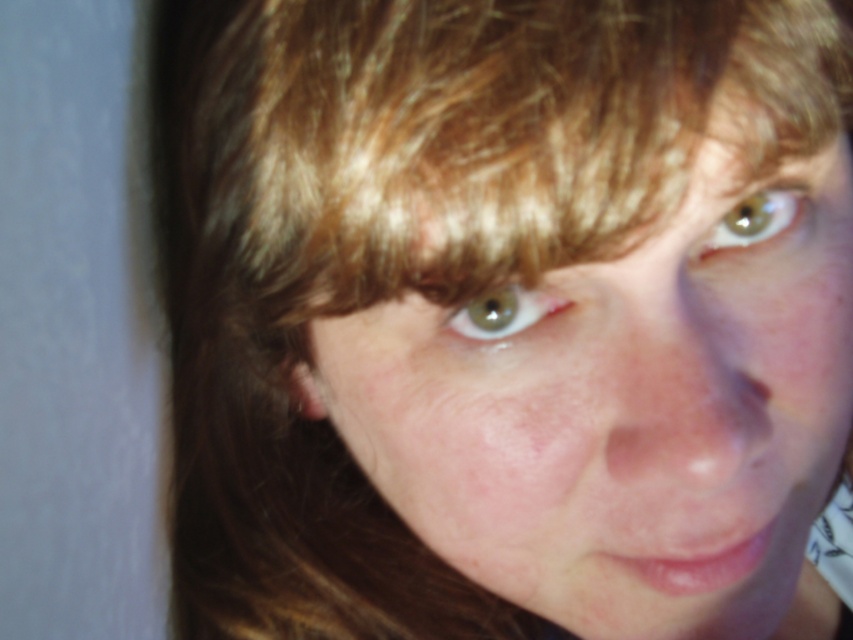
The image size is (853, 640). What do you see at coordinates (465, 136) in the screenshot?
I see `blonde hair at upper center` at bounding box center [465, 136].

Between blonde hair at upper center and green matte eye at upper right, which one is positioned lower?

green matte eye at upper right is below.

Is point (544, 113) closer to camera compared to point (782, 193)?

That is True.

The image size is (853, 640). I want to click on blonde hair at upper center, so click(465, 136).

Consider the image. Who is lower down, smooth skin face at center or green matte eye at upper right?

Positioned lower is smooth skin face at center.

Who is positioned more to the left, smooth skin face at center or green matte eye at upper right?

smooth skin face at center

What do you see at coordinates (627, 413) in the screenshot? I see `smooth skin face at center` at bounding box center [627, 413].

Find the location of a particular element. This screenshot has width=853, height=640. smooth skin face at center is located at coordinates (627, 413).

Who is lower down, blonde hair at upper center or green matte eye at center?

green matte eye at center is lower down.

Between blonde hair at upper center and green matte eye at center, which one appears on the left side from the viewer's perspective?

blonde hair at upper center is more to the left.

Which is in front, point (341, 212) or point (469, 301)?

Point (341, 212) is more forward.

I want to click on blonde hair at upper center, so click(x=465, y=136).